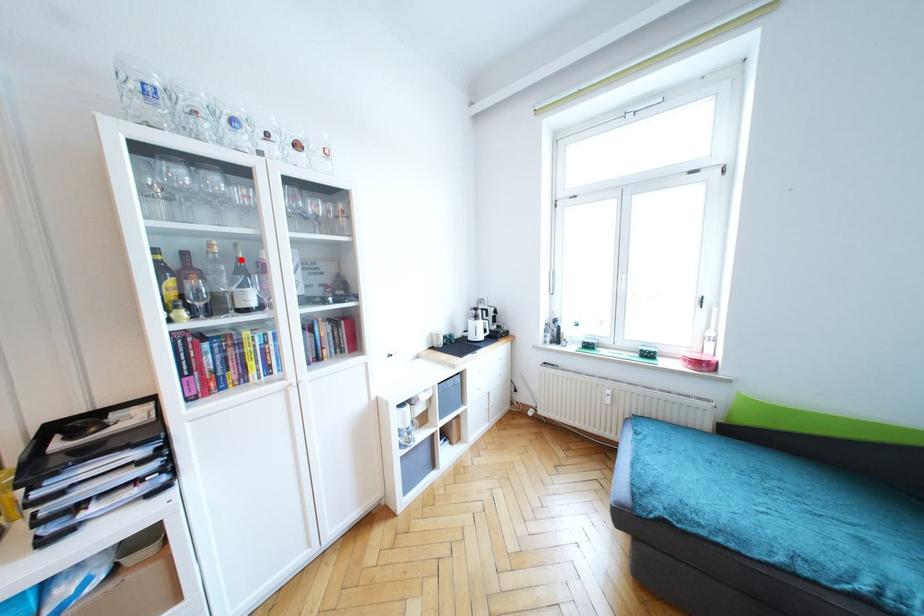
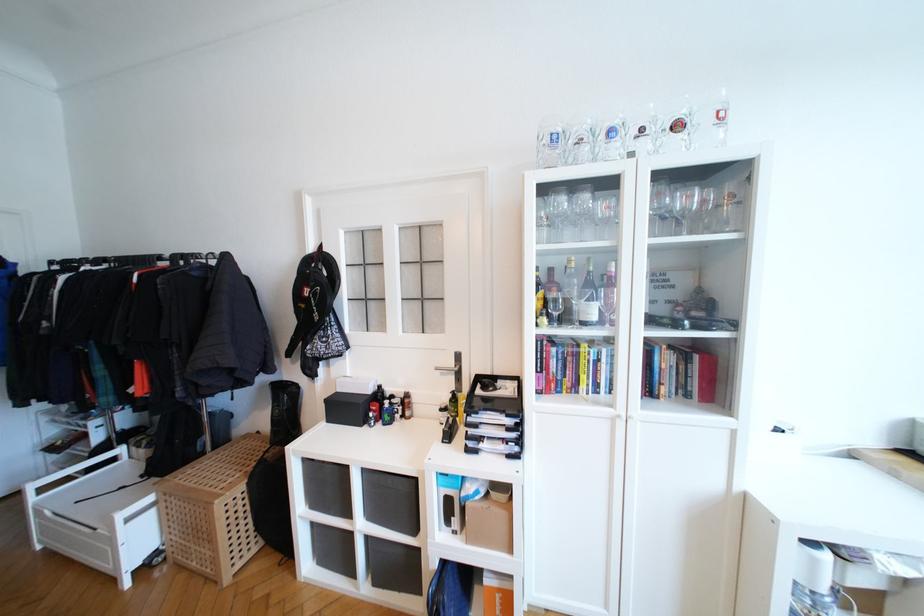
Locate, in the second image, the point that corresponds to the highlighted location in the first image.

(591, 273)